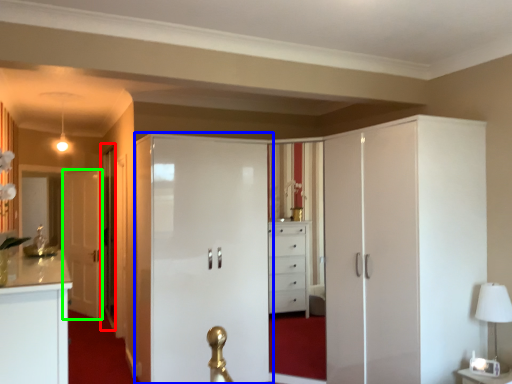
Question: Estimate the real-world distances between objects in this image. Which object is closer to glass door (highlighted by a red box), door (highlighted by a blue box) or door (highlighted by a green box)?

Choices:
 (A) door
 (B) door

Answer: (B)